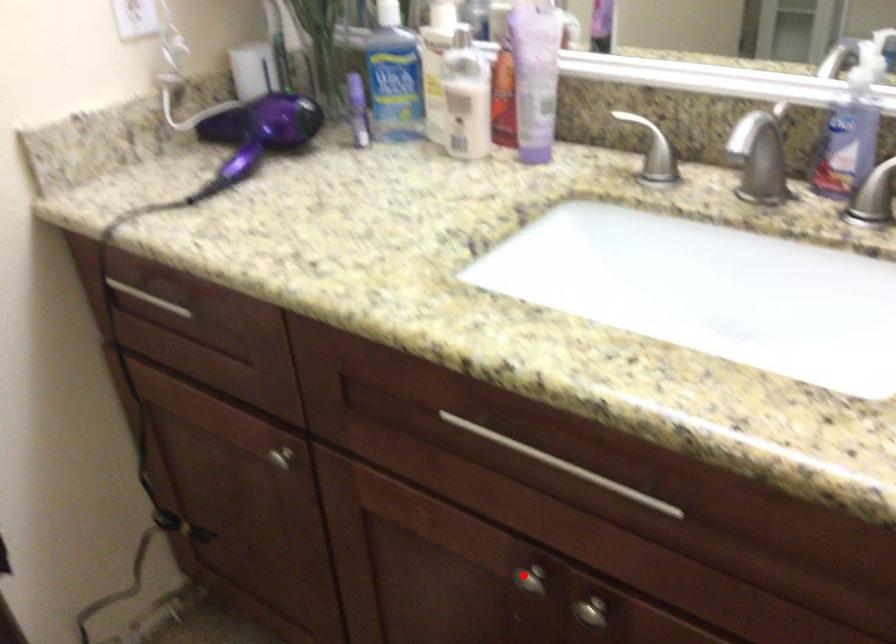
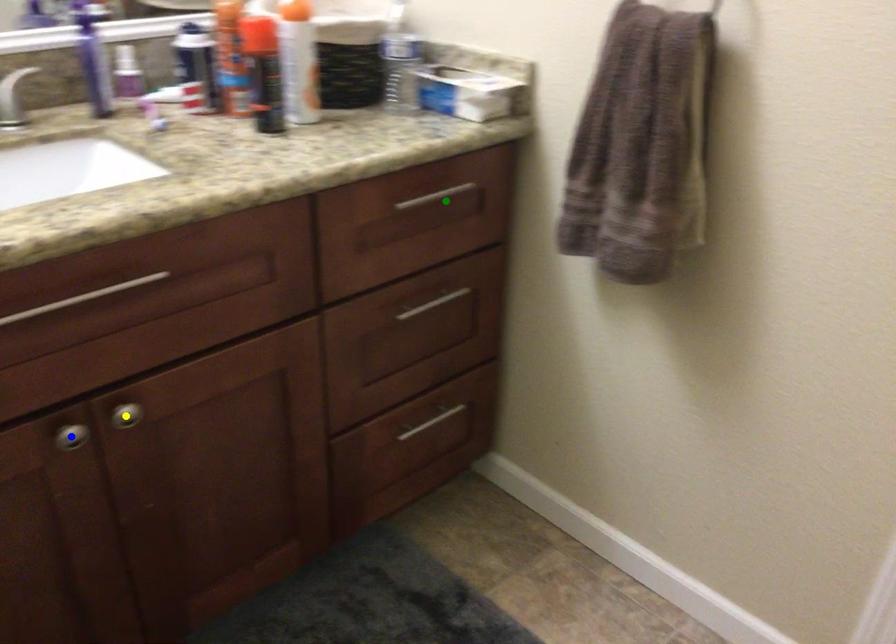
Question: I am providing you with two images of the same scene from different viewpoints. A red point is marked on the first image. You are given multiple points on the second image. Which point in image 2 represents the same 3d spot as the red point in image 1?

Choices:
 (A) green point
 (B) blue point
 (C) yellow point

Answer: (B)